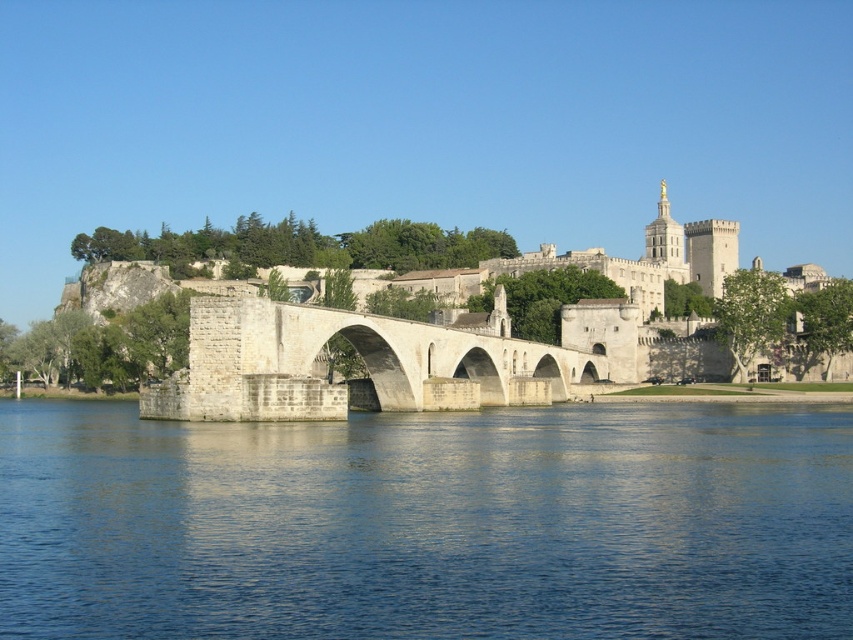
Between point (485, 492) and point (498, 353), which one is positioned in front?

Positioned in front is point (485, 492).

Between point (584, 604) and point (271, 349), which one is positioned behind?

Point (271, 349)

You are a GUI agent. You are given a task and a screenshot of the screen. Output one action in this format:
    pyautogui.click(x=<x>, y=<y>)
    Task: Click on the blue water at center
    
    Given the screenshot: What is the action you would take?
    427,524

Does white stone castle at center have a smaller size compared to white stone bridge at center?

No.

Between white stone castle at center and white stone bridge at center, which one has less height?

Standing shorter between the two is white stone bridge at center.

Between point (161, 416) and point (291, 353), which one is positioned in front?

Point (161, 416) is in front.

The width and height of the screenshot is (853, 640). Identify the location of white stone castle at center. (x=437, y=340).

Is point (659, 432) in front of point (512, 369)?

Yes.

Locate an element on the screen. This screenshot has width=853, height=640. blue water at center is located at coordinates (427, 524).